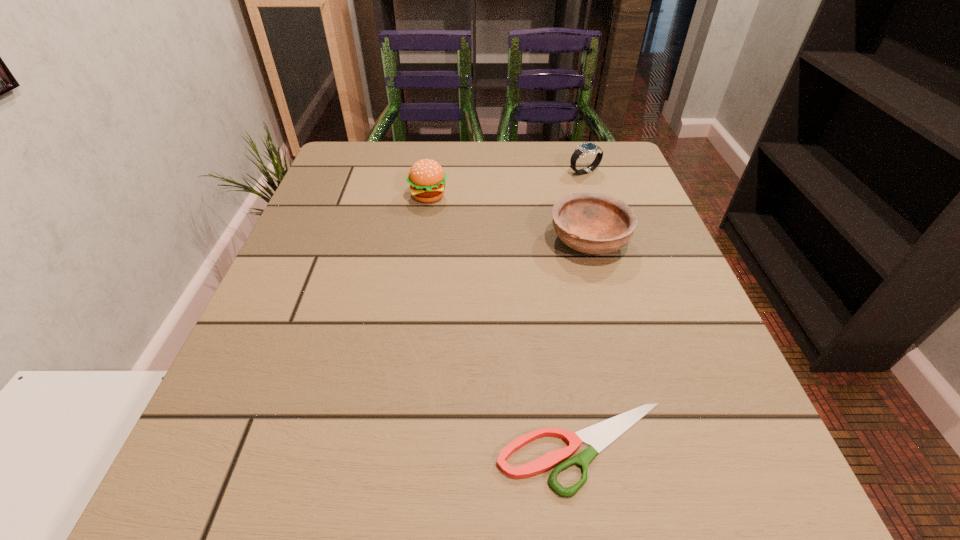
The width and height of the screenshot is (960, 540). In order to click on unoccupied position between the bowl and the third nearest object in this screenshot , I will do `click(509, 219)`.

Where is `vacant space in between the farthest object and the tallest object`? vacant space in between the farthest object and the tallest object is located at coordinates (506, 184).

The height and width of the screenshot is (540, 960). Find the location of `free space between the hamburger and the watch`. free space between the hamburger and the watch is located at coordinates (506, 184).

Identify the location of vacant space in between the watch and the scissors. (585, 309).

Identify which object is the second nearest to the scissors. Please provide its 2D coordinates. Your answer should be formatted as a tuple, i.e. [(x, y)], where the tuple contains the x and y coordinates of a point satisfying the conditions above.

[(426, 177)]

You are a GUI agent. You are given a task and a screenshot of the screen. Output one action in this format:
    pyautogui.click(x=<x>, y=<y>)
    Task: Click on the object that can be found as the second closest to the watch
    
    Given the screenshot: What is the action you would take?
    [426, 177]

Find the location of `free space in the image that satisfies the following two spatial constraints: 1. on the back side of the bowl; 2. on the right side of the scissors`. free space in the image that satisfies the following two spatial constraints: 1. on the back side of the bowl; 2. on the right side of the scissors is located at coordinates (548, 240).

Locate an element on the screen. The image size is (960, 540). vacant space that satisfies the following two spatial constraints: 1. on the front side of the hamburger; 2. on the left side of the scissors is located at coordinates (391, 448).

I want to click on free region that satisfies the following two spatial constraints: 1. on the back side of the scissors; 2. on the right side of the watch, so click(536, 172).